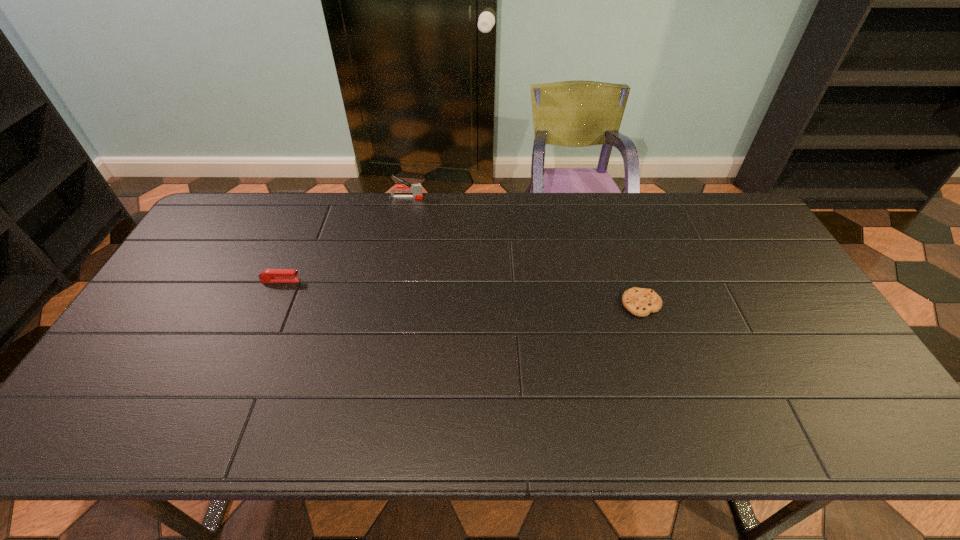
The height and width of the screenshot is (540, 960). Find the location of `vacant region between the leftmost object and the right stapler`. vacant region between the leftmost object and the right stapler is located at coordinates (344, 239).

Where is `vacant space that's between the nearest object and the right stapler`? This screenshot has height=540, width=960. vacant space that's between the nearest object and the right stapler is located at coordinates pos(523,251).

At what (x,y) coordinates should I click in order to perform the action: click on free spot between the nearer stapler and the farther stapler. Please return your answer as a coordinate pair (x, y). Looking at the image, I should click on (344, 239).

Locate an element on the screen. This screenshot has height=540, width=960. free space that is in between the second object from right to left and the nearest object is located at coordinates (523, 251).

Identify which object is located as the second nearest to the rightmost object. Please provide its 2D coordinates. Your answer should be formatted as a tuple, i.e. [(x, y)], where the tuple contains the x and y coordinates of a point satisfying the conditions above.

[(269, 275)]

The height and width of the screenshot is (540, 960). Find the location of `object that is the second closest to the cookie`. object that is the second closest to the cookie is located at coordinates (269, 275).

Where is `free space that satisfies the following two spatial constraints: 1. on the front-facing side of the leftmost object; 2. on the right side of the cookie`? This screenshot has height=540, width=960. free space that satisfies the following two spatial constraints: 1. on the front-facing side of the leftmost object; 2. on the right side of the cookie is located at coordinates (271, 305).

Where is `free space that satisfies the following two spatial constraints: 1. on the back side of the rightmost object; 2. on the handle side of the second object from right to left`? The image size is (960, 540). free space that satisfies the following two spatial constraints: 1. on the back side of the rightmost object; 2. on the handle side of the second object from right to left is located at coordinates (606, 198).

At what (x,y) coordinates should I click in order to perform the action: click on free point that satisfies the following two spatial constraints: 1. on the handle side of the taller stapler; 2. on the left side of the nearest object. Please return your answer as a coordinate pair (x, y). Image resolution: width=960 pixels, height=540 pixels. Looking at the image, I should click on coord(385,305).

The height and width of the screenshot is (540, 960). Identify the location of blank space that satisfies the following two spatial constraints: 1. on the handle side of the tallest object; 2. on the back side of the nearest object. (385, 305).